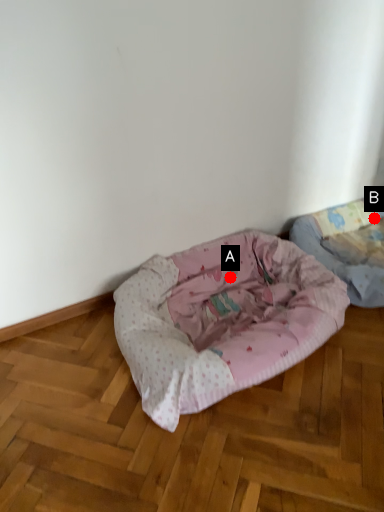
Question: Two points are circled on the image, labeled by A and B beside each circle. Which point appears farthest from the camera in this image?

Choices:
 (A) A is further
 (B) B is further

Answer: (B)